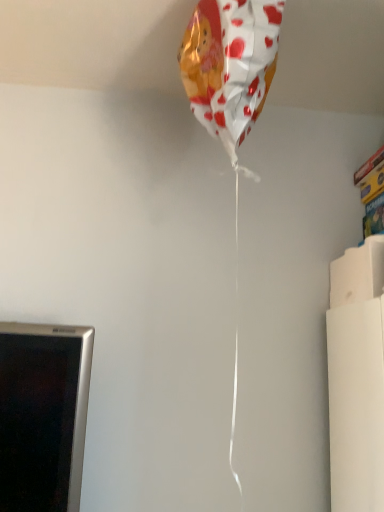
The width and height of the screenshot is (384, 512). What do you see at coordinates (230, 64) in the screenshot?
I see `shiny metallic balloon at upper center` at bounding box center [230, 64].

Measure the distance between shiny metallic balloon at upper center and camera.

shiny metallic balloon at upper center is 82.33 centimeters from camera.

Where is `shiny metallic balloon at upper center`? The width and height of the screenshot is (384, 512). shiny metallic balloon at upper center is located at coordinates (230, 64).

Locate an element on the screen. The height and width of the screenshot is (512, 384). shiny metallic balloon at upper center is located at coordinates (230, 64).